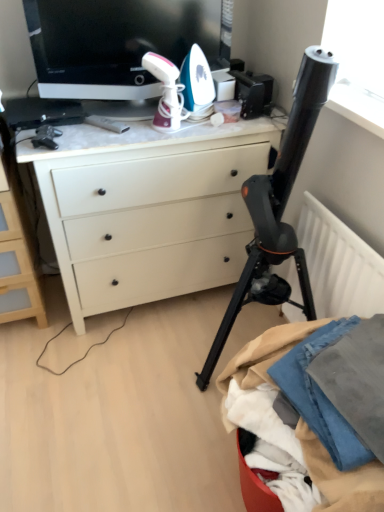
Locate an element on the screen. denim fabric at lower right is located at coordinates (260, 373).

Image resolution: width=384 pixels, height=512 pixels. What do you see at coordinates (260, 373) in the screenshot?
I see `denim fabric at lower right` at bounding box center [260, 373].

Find the location of `white matte radiator at right`. white matte radiator at right is located at coordinates (339, 264).

Locate an element on the screen. white matte desk at center is located at coordinates (149, 209).

The image size is (384, 512). Identify the location of denim fabric at lower right. (260, 373).

Looking at the image, does black glossy television at upper center seem bigger or smaller compared to black matte tripod at center?

Considering their sizes, black glossy television at upper center takes up less space than black matte tripod at center.

Is black glossy television at upper center situated inside black matte tripod at center or outside?

black glossy television at upper center cannot be found inside black matte tripod at center.

In order to click on television behind the black matte tripod at center in this screenshot , I will do `click(115, 42)`.

In the image, is black glossy television at upper center positioned in front of or behind black matte tripod at center?

black glossy television at upper center is behind black matte tripod at center.

From the image's perspective, which is below, white matte chest of drawers at left or denim fabric at lower right?

denim fabric at lower right appears lower in the image.

Is white matte chest of drawers at left oriented away from denim fabric at lower right?

No, denim fabric at lower right is not at the back of white matte chest of drawers at left.

Locate an element on the screen. The height and width of the screenshot is (512, 384). clothing that is in front of the white matte chest of drawers at left is located at coordinates (260, 373).

Can you confirm if white matte chest of drawers at left is thinner than denim fabric at lower right?

Correct, the width of white matte chest of drawers at left is less than that of denim fabric at lower right.

Is denim fabric at lower right positioned with its back to black matte tripod at center?

No, denim fabric at lower right is not facing the opposite direction of black matte tripod at center.

Considering the relative sizes of denim fabric at lower right and black matte tripod at center in the image provided, is denim fabric at lower right shorter than black matte tripod at center?

Yes.

Looking at this image, which object is further away from the camera, denim fabric at lower right or black matte tripod at center?

denim fabric at lower right.

Find the location of a particular element. clothing to the right of black matte tripod at center is located at coordinates (260, 373).

Is black matte tripod at center far from denim fabric at lower right?

black matte tripod at center is near denim fabric at lower right, not far away.

Considering the positions of objects black matte tripod at center and denim fabric at lower right in the image provided, who is in front, black matte tripod at center or denim fabric at lower right?

black matte tripod at center is closer to the camera.

Which of these two, black matte tripod at center or denim fabric at lower right, is wider?

Wider between the two is black matte tripod at center.

Can you confirm if white matte chest of drawers at left is smaller than black matte tripod at center?

Correct, white matte chest of drawers at left occupies less space than black matte tripod at center.

Are white matte chest of drawers at left and black matte tripod at center beside each other?

They are not placed beside each other.

Which object is thinner, white matte chest of drawers at left or black matte tripod at center?

With smaller width is white matte chest of drawers at left.

Considering the relative positions of denim fabric at lower right and white matte desk at center in the image provided, is denim fabric at lower right to the left of white matte desk at center from the viewer's perspective?

No.

Is denim fabric at lower right not close to white matte desk at center?

No.

Considering the positions of objects denim fabric at lower right and white matte desk at center in the image provided, who is behind, denim fabric at lower right or white matte desk at center?

white matte desk at center.

Between denim fabric at lower right and white matte desk at center, which one has smaller width?

Thinner between the two is denim fabric at lower right.

Is black glossy television at upper center not near white matte desk at center?

That's not correct — black glossy television at upper center is a little close to white matte desk at center.

In terms of width, does black glossy television at upper center look wider or thinner when compared to white matte desk at center?

In the image, black glossy television at upper center appears to be more narrow than white matte desk at center.

Which object is closer to the camera taking this photo, black glossy television at upper center or white matte desk at center?

black glossy television at upper center.

From a real-world perspective, does black glossy television at upper center stand above white matte desk at center?

Yes, from a real-world perspective, black glossy television at upper center is above white matte desk at center.

Locate an element on the screen. Image resolution: width=384 pixels, height=512 pixels. tripod on the right of black glossy television at upper center is located at coordinates (278, 207).

Where is `the chest of drawers behind the denim fabric at lower right`? the chest of drawers behind the denim fabric at lower right is located at coordinates (17, 255).

Based on their spatial positions, is white matte radiator at right or black matte tripod at center closer to white matte desk at center?

black matte tripod at center.

Based on their spatial positions, is black glossy television at upper center or denim fabric at lower right closer to white matte desk at center?

black glossy television at upper center.

Which object lies further to the anchor point denim fabric at lower right, black matte tripod at center or white matte desk at center?

Based on the image, white matte desk at center appears to be further to denim fabric at lower right.

From the image, which object appears to be farther from white matte radiator at right, black glossy television at upper center or white matte desk at center?

black glossy television at upper center lies further to white matte radiator at right than the other object.

From the image, which object appears to be farther from white matte chest of drawers at left, black glossy television at upper center or white matte desk at center?

black glossy television at upper center is positioned further to the anchor white matte chest of drawers at left.

Which object lies further to the anchor point white matte desk at center, black matte tripod at center or white matte chest of drawers at left?

Among the two, white matte chest of drawers at left is located further to white matte desk at center.

From the image, which object appears to be farther from black glossy television at upper center, white matte desk at center or denim fabric at lower right?

Based on the image, denim fabric at lower right appears to be further to black glossy television at upper center.

From the picture: Which object lies nearer to the anchor point black glossy television at upper center, white matte chest of drawers at left or black matte tripod at center?

white matte chest of drawers at left lies closer to black glossy television at upper center than the other object.

Identify the location of desk located between white matte chest of drawers at left and denim fabric at lower right in the left-right direction. (149, 209).

Where is `tripod between white matte chest of drawers at left and white matte radiator at right from left to right`? The width and height of the screenshot is (384, 512). tripod between white matte chest of drawers at left and white matte radiator at right from left to right is located at coordinates (278, 207).

Image resolution: width=384 pixels, height=512 pixels. Find the location of `desk between black glossy television at upper center and black matte tripod at center in the up-down direction`. desk between black glossy television at upper center and black matte tripod at center in the up-down direction is located at coordinates (149, 209).

I want to click on chest of drawers between black glossy television at upper center and denim fabric at lower right in the vertical direction, so click(17, 255).